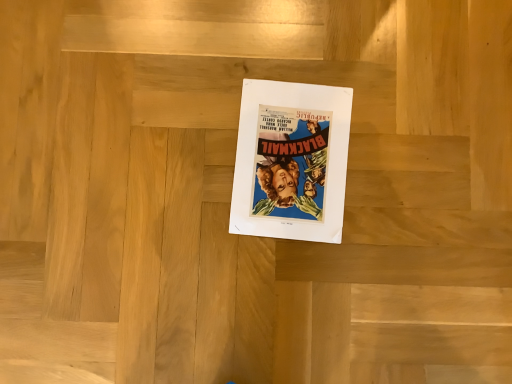
Where is `vacant space to the right of matte paper poster at center`? vacant space to the right of matte paper poster at center is located at coordinates (408, 184).